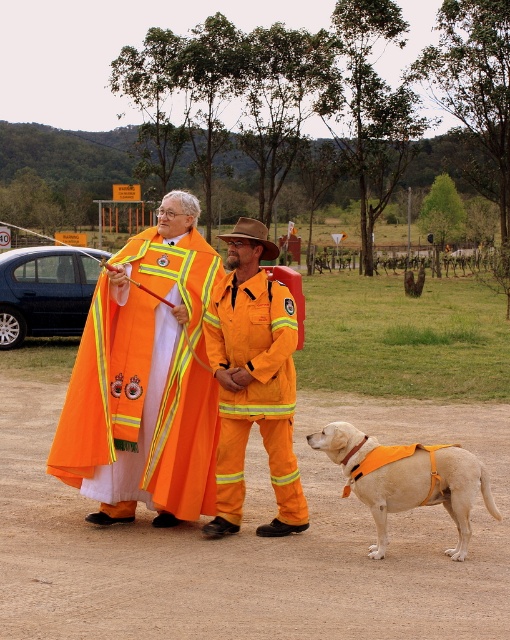
From the picture: You are a photographer trying to capture a clear shot of both the high visibility fabric coat at center and the light brown fabric dog at lower right. Since you want both subjects to be in focus, you need to adjust your camera settings. Which subject should you prioritize focusing on first to ensure both are sharp?

The high visibility fabric coat at center is not as tall as the light brown fabric dog at lower right. To ensure both are in focus, you should focus on the light brown fabric dog at lower right first because it is taller and farther away, requiring a greater depth of field.

You are a photographer planning to capture a group photo of the orange fireproof suit at center and the light brown fabric dog at lower right. To ensure both subjects are in focus, you need to know their relative heights. Which subject is taller?

The orange fireproof suit at center is taller than the light brown fabric dog at lower right.